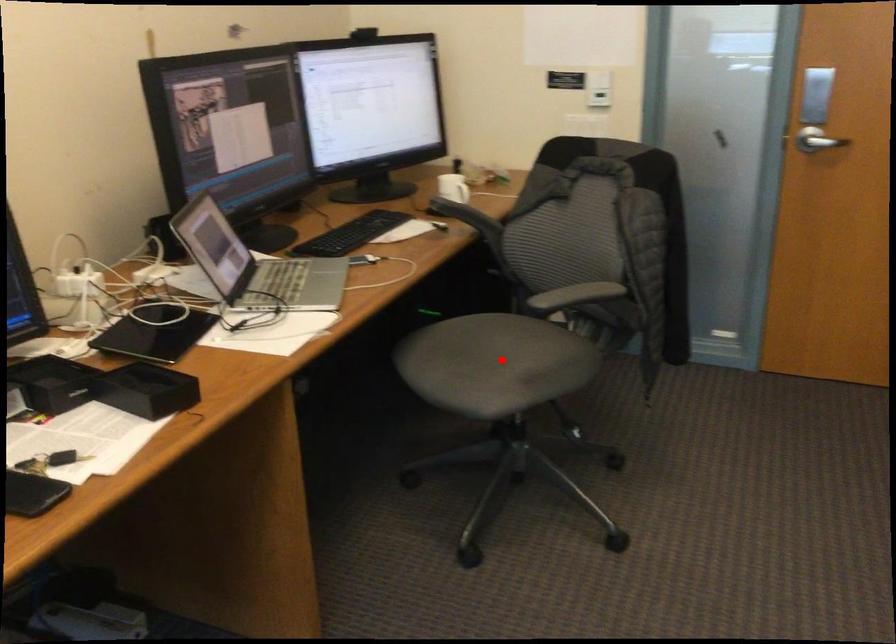
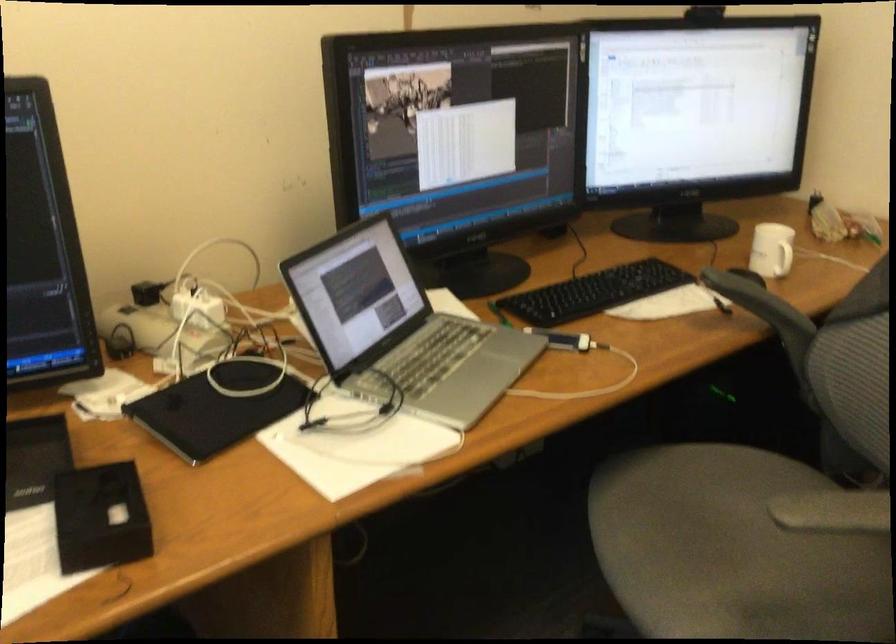
Question: I am providing you with two images of the same scene from different viewpoints. In image1, a red point is highlighted. Considering the same 3D point in image2, which of the following is correct?

Choices:
 (A) It is closer
 (B) It is farther

Answer: (A)